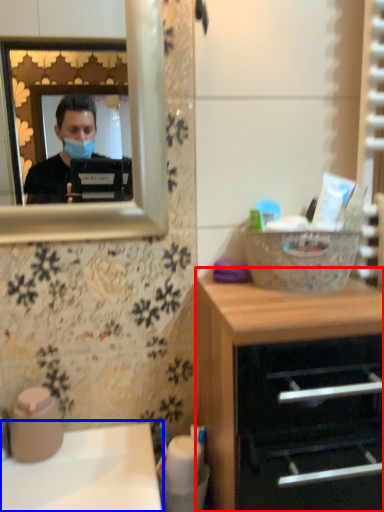
Question: Which object is further to the camera taking this photo, chest of drawers (highlighted by a red box) or sink (highlighted by a blue box)?

Choices:
 (A) chest of drawers
 (B) sink

Answer: (B)